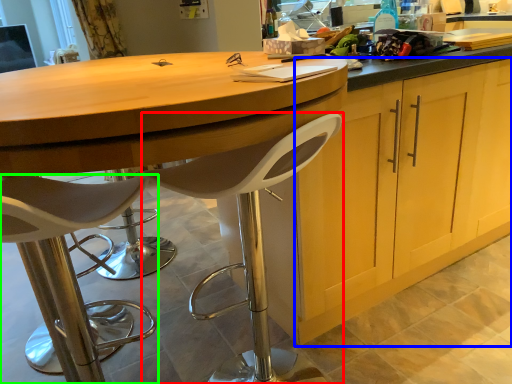
Question: Based on their relative distances, which object is farther from chair (highlighted by a red box)? Choose from cabinetry (highlighted by a blue box) and chair (highlighted by a green box).

Choices:
 (A) cabinetry
 (B) chair

Answer: (A)